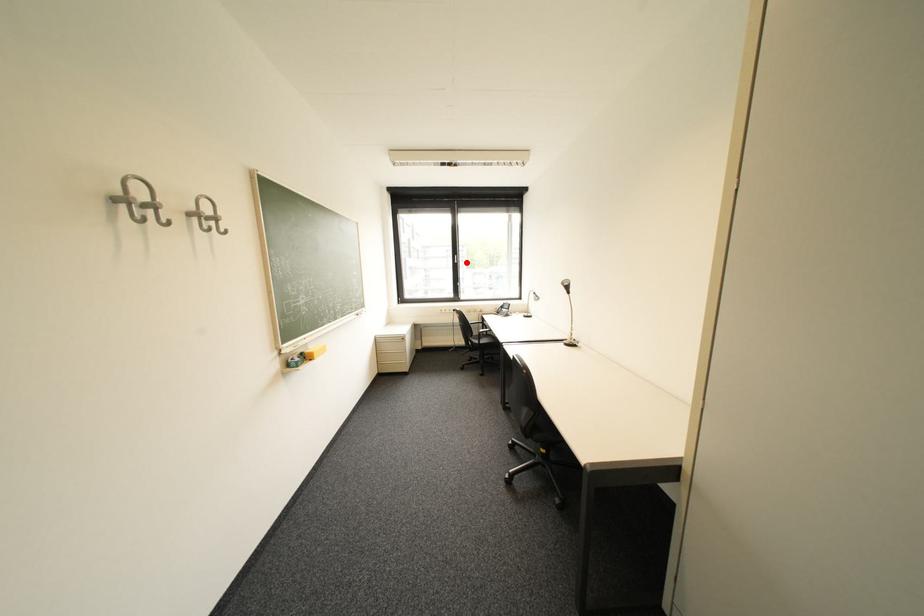
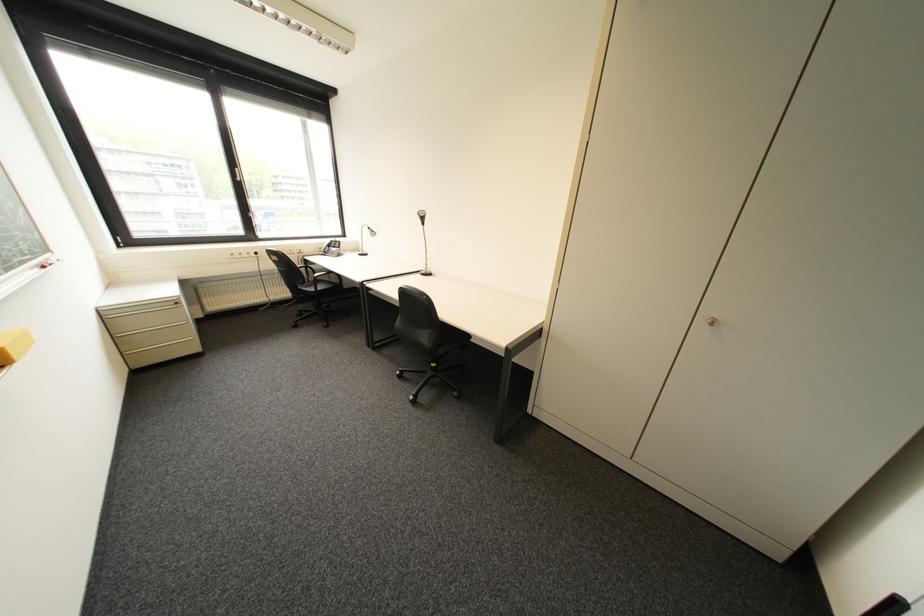
Question: I am providing you with two images of the same scene from different viewpoints. In image1, a red point is highlighted. Considering the same 3D point in image2, which of the following is correct?

Choices:
 (A) It is closer
 (B) It is farther

Answer: (B)